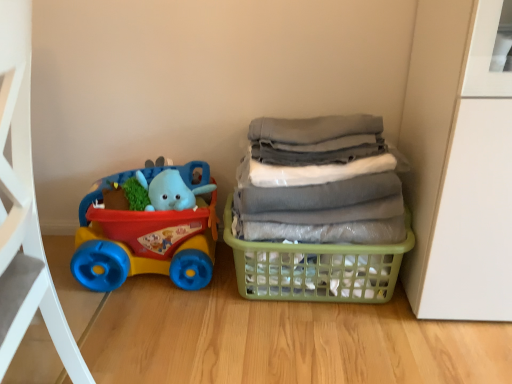
Question: Considering the relative positions of rubberized plastic toy car at left and green plastic basket at right in the image provided, is rubberized plastic toy car at left to the left of green plastic basket at right from the viewer's perspective?

Choices:
 (A) yes
 (B) no

Answer: (A)

Question: From the image's perspective, is rubberized plastic toy car at left beneath green plastic basket at right?

Choices:
 (A) yes
 (B) no

Answer: (B)

Question: Does rubberized plastic toy car at left have a lesser width compared to green plastic basket at right?

Choices:
 (A) yes
 (B) no

Answer: (A)

Question: Can you see rubberized plastic toy car at left touching green plastic basket at right?

Choices:
 (A) yes
 (B) no

Answer: (B)

Question: Is rubberized plastic toy car at left outside of green plastic basket at right?

Choices:
 (A) no
 (B) yes

Answer: (B)

Question: From a real-world perspective, relative to rubberized plastic toy car at left, is gray fabric laundry at right vertically above or below?

Choices:
 (A) below
 (B) above

Answer: (B)

Question: Choose the correct answer: Is gray fabric laundry at right inside rubberized plastic toy car at left or outside it?

Choices:
 (A) outside
 (B) inside

Answer: (A)

Question: Considering the positions of gray fabric laundry at right and rubberized plastic toy car at left in the image, is gray fabric laundry at right wider or thinner than rubberized plastic toy car at left?

Choices:
 (A) thin
 (B) wide

Answer: (B)

Question: From the image's perspective, is gray fabric laundry at right positioned above or below rubberized plastic toy car at left?

Choices:
 (A) below
 (B) above

Answer: (B)

Question: Is green plastic basket at right taller or shorter than rubberized plastic toy car at left?

Choices:
 (A) tall
 (B) short

Answer: (B)

Question: Relative to rubberized plastic toy car at left, is green plastic basket at right in front or behind?

Choices:
 (A) front
 (B) behind

Answer: (A)

Question: Does point (301, 264) appear closer or farther from the camera than point (82, 210)?

Choices:
 (A) closer
 (B) farther

Answer: (A)

Question: Looking at the image, does green plastic basket at right seem bigger or smaller compared to rubberized plastic toy car at left?

Choices:
 (A) big
 (B) small

Answer: (A)

Question: Considering the positions of green plastic basket at right and gray fabric laundry at right in the image, is green plastic basket at right taller or shorter than gray fabric laundry at right?

Choices:
 (A) tall
 (B) short

Answer: (B)

Question: In terms of width, does green plastic basket at right look wider or thinner when compared to gray fabric laundry at right?

Choices:
 (A) wide
 (B) thin

Answer: (A)